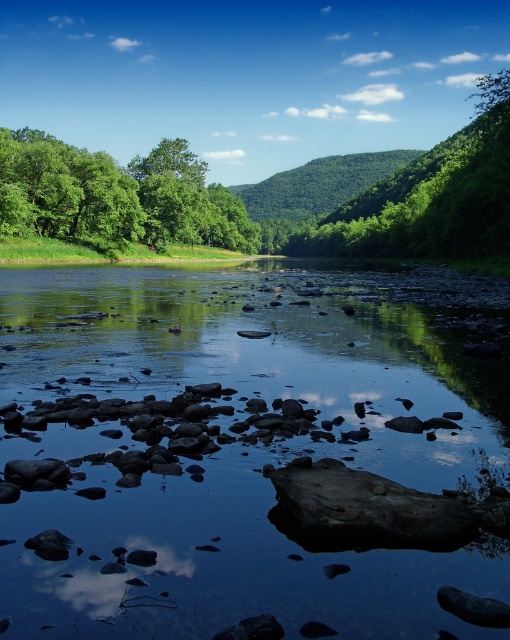
Is point (185, 589) positioned in front of point (125, 205)?

Yes.

Which is in front, point (456, 580) or point (241, 209)?

Positioned in front is point (456, 580).

Locate an element on the screen. This screenshot has height=640, width=510. smooth rock stream at center is located at coordinates (240, 458).

Does smooth rock stream at center have a smaller size compared to green leafy tree at upper center?

Yes, smooth rock stream at center is smaller than green leafy tree at upper center.

Is point (389, 614) in front of point (471, 134)?

Yes, point (389, 614) is in front of point (471, 134).

The height and width of the screenshot is (640, 510). What are the coordinates of `smooth rock stream at center` in the screenshot? It's located at (240, 458).

Does green leafy tree at upper left have a lesser height compared to green leafy tree at upper center?

Correct, green leafy tree at upper left is not as tall as green leafy tree at upper center.

Is point (91, 209) positioned before point (440, 202)?

Yes.

Which is in front, point (125, 243) or point (412, 189)?

Point (125, 243) is in front.

The image size is (510, 640). I want to click on green leafy tree at upper left, so click(x=115, y=196).